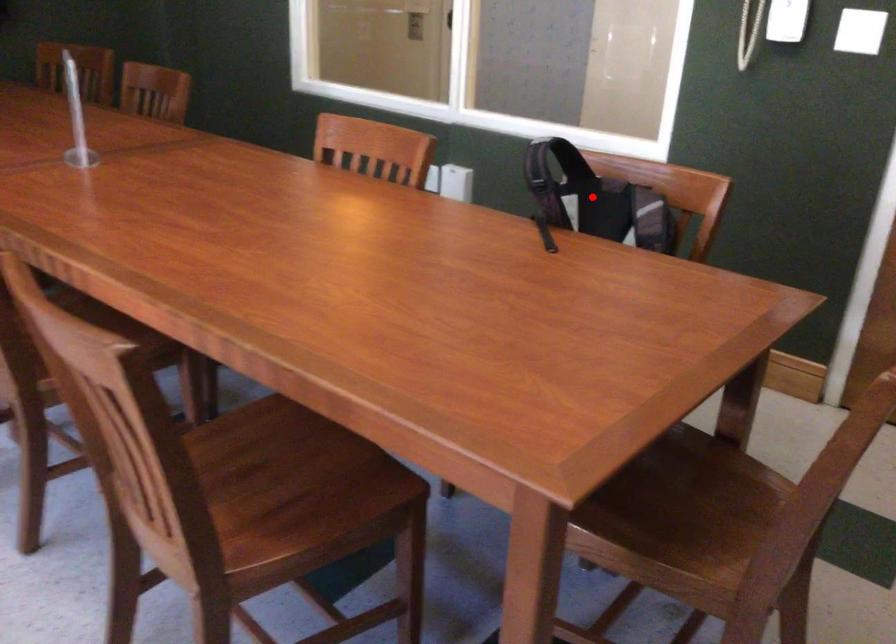
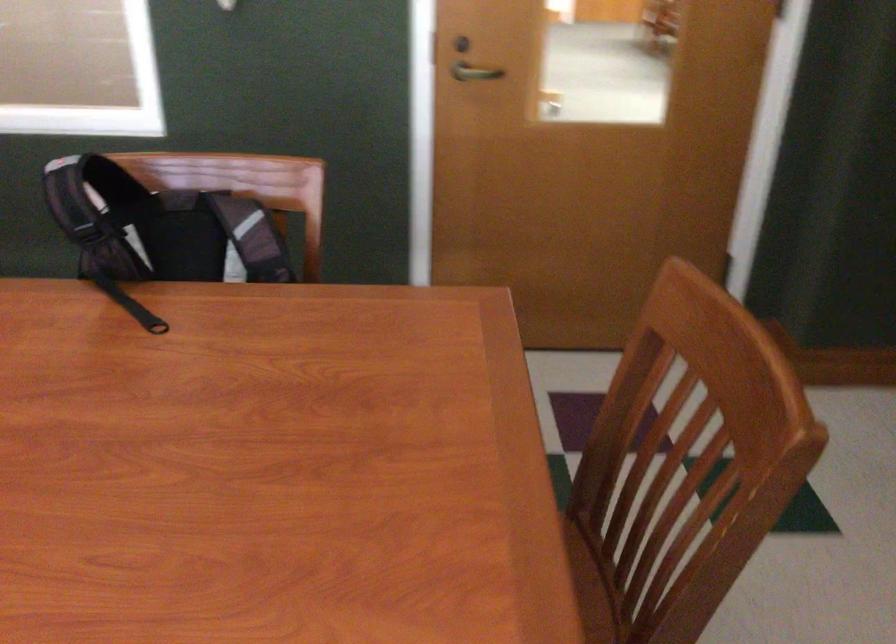
Question: I am providing you with two images of the same scene from different viewpoints. A red point is shown in image1. For the corresponding object point in image2, is it positioned nearer or farther from the camera?

Choices:
 (A) Nearer
 (B) Farther

Answer: (A)